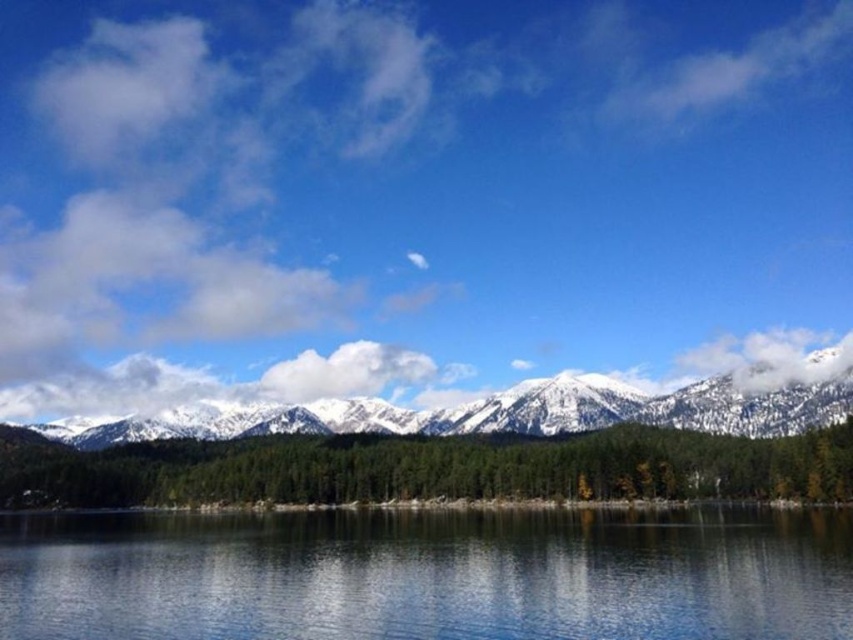
Question: Which of the following is the closest to the observer?

Choices:
 (A) transparent glass water at center
 (B) snowy white mountain range at center

Answer: (A)

Question: Does transparent glass water at center have a lesser width compared to snowy white mountain range at center?

Choices:
 (A) yes
 (B) no

Answer: (A)

Question: Does transparent glass water at center have a larger size compared to snowy white mountain range at center?

Choices:
 (A) no
 (B) yes

Answer: (A)

Question: Which of the following is the closest to the observer?

Choices:
 (A) (189, 404)
 (B) (372, 580)

Answer: (B)

Question: Which object appears farthest from the camera in this image?

Choices:
 (A) snowy white mountain range at center
 (B) transparent glass water at center

Answer: (A)

Question: Can you confirm if transparent glass water at center is positioned to the left of snowy white mountain range at center?

Choices:
 (A) no
 (B) yes

Answer: (A)